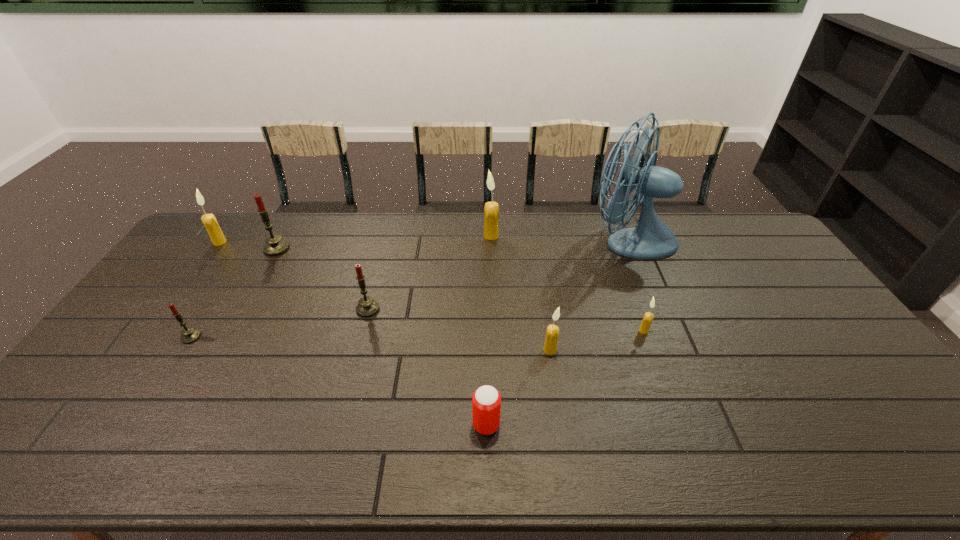
This screenshot has width=960, height=540. I want to click on the tallest object, so click(x=651, y=238).

Identify the location of the third candle from right to left. (491, 211).

This screenshot has height=540, width=960. In order to click on the third cream candle from right to left in this screenshot , I will do `click(491, 211)`.

Where is `the second red candle from left to right`? The height and width of the screenshot is (540, 960). the second red candle from left to right is located at coordinates (275, 245).

Where is `the fifth candle from right to left`? the fifth candle from right to left is located at coordinates (x=275, y=245).

What are the coordinates of `the leftmost object` in the screenshot? It's located at (217, 237).

Image resolution: width=960 pixels, height=540 pixels. I want to click on the leftmost cream candle, so click(x=217, y=237).

At what (x,y) coordinates should I click in order to perform the action: click on the fifth nearest object. Please return your answer as a coordinate pair (x, y). The width and height of the screenshot is (960, 540). Looking at the image, I should click on (367, 307).

The width and height of the screenshot is (960, 540). Identify the location of the fourth object from left to right. (367, 307).

Locate an element on the screen. The image size is (960, 540). the second smallest cream candle is located at coordinates (552, 332).